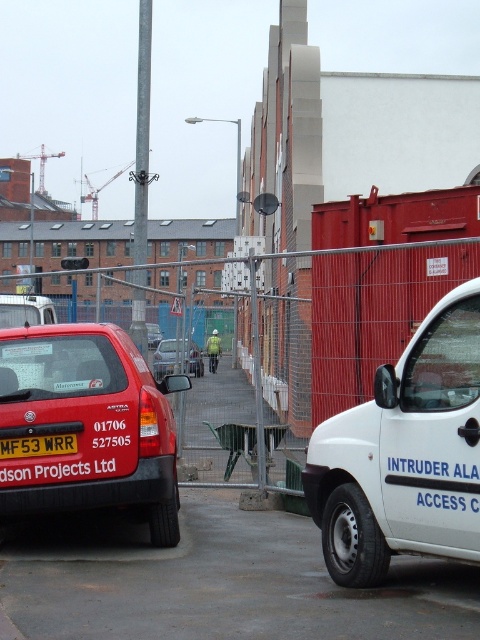
Between point (141, 467) and point (166, 349), which one is positioned behind?

The point (166, 349) is behind.

Is matte red van at center-left smaller than matte red car at center?

No, matte red van at center-left is not smaller than matte red car at center.

Which is behind, point (24, 429) or point (184, 364)?

The point (184, 364) is more distant.

In order to click on matte red van at center-left in this screenshot , I will do `click(87, 424)`.

I want to click on matte red van at center-left, so click(x=87, y=424).

Does point (128, 392) lie behind point (33, 442)?

Yes, point (128, 392) is behind point (33, 442).

Find the location of `matte red van at center-left`. matte red van at center-left is located at coordinates (87, 424).

Can you confirm if metal mesh fence at center is shorter than yellow matte license plate at center?

Incorrect, metal mesh fence at center's height does not fall short of yellow matte license plate at center's.

Is metal mesh fence at center thinner than yellow matte license plate at center?

No, metal mesh fence at center is not thinner than yellow matte license plate at center.

Which is behind, point (84, 404) or point (3, 445)?

Point (84, 404)

Where is `metal mesh fence at center`? Image resolution: width=480 pixels, height=640 pixels. metal mesh fence at center is located at coordinates (85, 419).